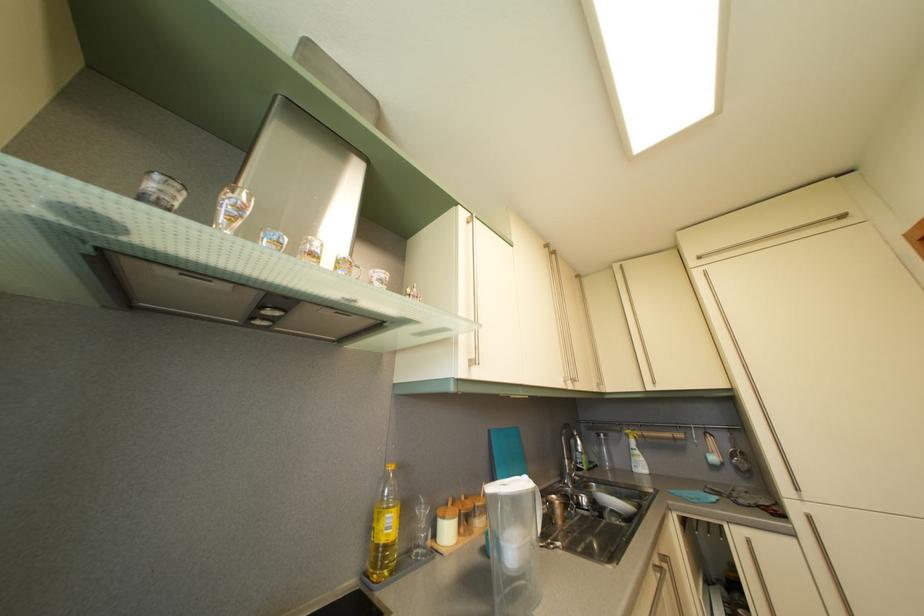
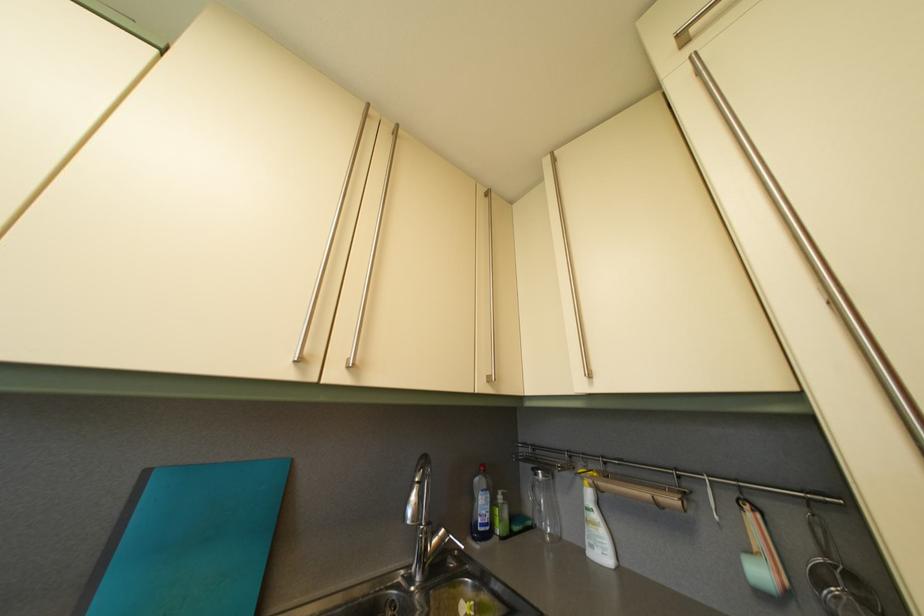
In the second image, find the point that corresponds to (x=497, y=439) in the first image.

(154, 480)